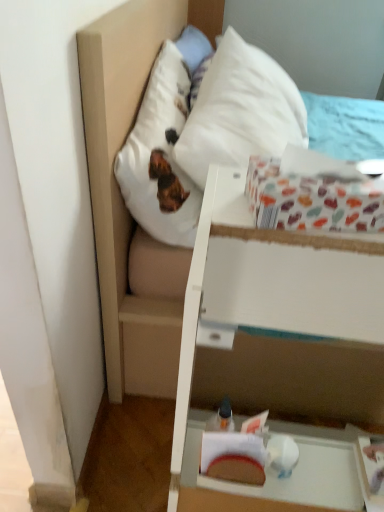
Question: Is white matte vanity at lower right in front of or behind white soft pillow at upper center in the image?

Choices:
 (A) front
 (B) behind

Answer: (A)

Question: Based on their positions, is white matte vanity at lower right located to the left or right of white soft pillow at upper center?

Choices:
 (A) right
 (B) left

Answer: (A)

Question: Estimate the real-world distances between objects in this image. Which object is farther from the white soft pillow at upper center?

Choices:
 (A) multicolored paper at upper right
 (B) white matte vanity at lower right

Answer: (B)

Question: Which object is the closest to the white soft pillow at upper center?

Choices:
 (A) multicolored paper at upper right
 (B) white matte vanity at lower right

Answer: (A)